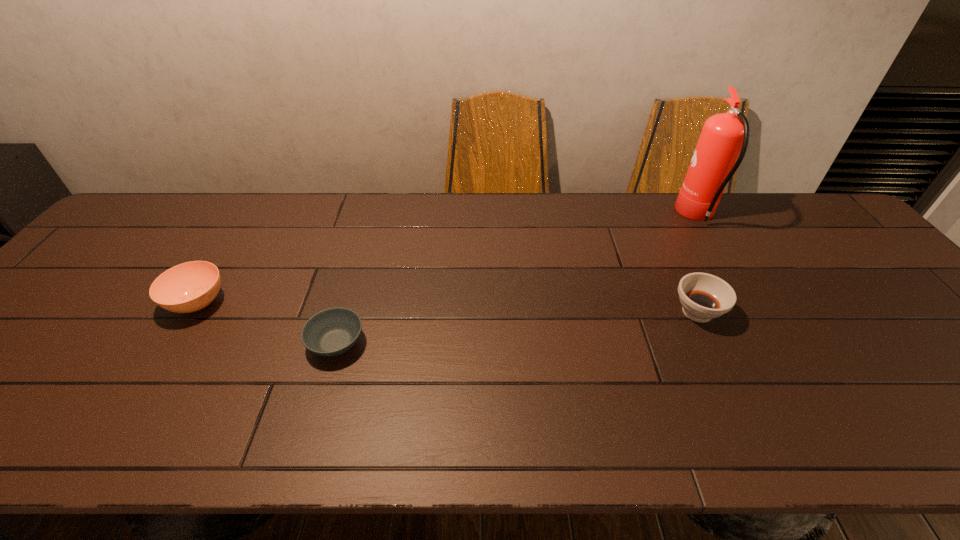
Identify the location of vacant space situated 0.300m on the front of the leftmost object. (108, 446).

Find the location of a particular element. free space located 0.070m on the back of the second soup bowl from left to right is located at coordinates (348, 300).

Where is `object present at the far edge`? This screenshot has width=960, height=540. object present at the far edge is located at coordinates (723, 141).

Image resolution: width=960 pixels, height=540 pixels. I want to click on free space at the far edge, so click(x=767, y=228).

You are a GUI agent. You are given a task and a screenshot of the screen. Output one action in this format:
    pyautogui.click(x=<x>, y=<y>)
    Task: Click on the free spot at the near edge of the desktop
    The image size is (960, 540).
    Given the screenshot: What is the action you would take?
    pyautogui.click(x=482, y=451)

Where is `blank space at the right edge of the desktop`? Image resolution: width=960 pixels, height=540 pixels. blank space at the right edge of the desktop is located at coordinates (852, 300).

This screenshot has width=960, height=540. In the image, there is a desktop. Identify the location of vacant region at the far right corner. (806, 238).

Where is `free space between the rightmost object and the leftmost soup bowl`? The image size is (960, 540). free space between the rightmost object and the leftmost soup bowl is located at coordinates (447, 259).

I want to click on unoccupied position between the leftmost soup bowl and the second object from left to right, so click(x=267, y=323).

Locate an element on the screen. vacant area that lies between the farthest object and the leftmost soup bowl is located at coordinates (447, 259).